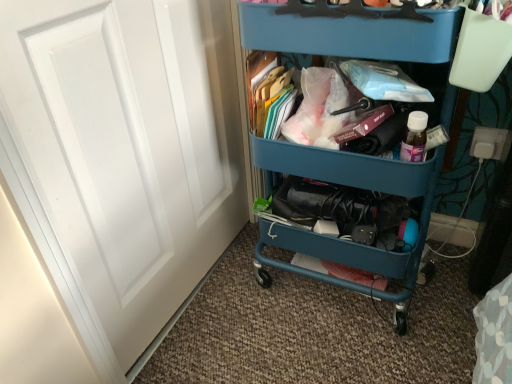
Question: Is teal plastic cart at center in front of or behind blue plastic cart at upper center in the image?

Choices:
 (A) front
 (B) behind

Answer: (A)

Question: Considering the positions of point (318, 170) and point (366, 147), is point (318, 170) closer or farther from the camera than point (366, 147)?

Choices:
 (A) farther
 (B) closer

Answer: (A)

Question: Estimate the real-world distances between objects in this image. Which object is closer to the blue plastic cart at upper center?

Choices:
 (A) white matte door at left
 (B) teal plastic cart at center

Answer: (B)

Question: Which object is the closest to the teal plastic cart at center?

Choices:
 (A) blue plastic cart at upper center
 (B) white matte door at left

Answer: (A)